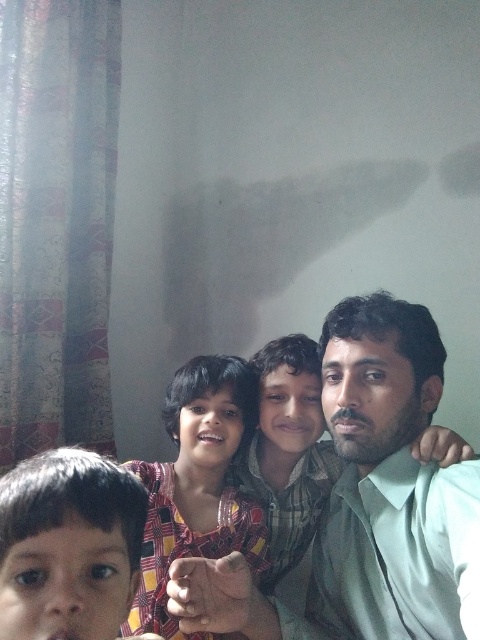
Does matte green shirt at center have a smaller size compared to plaid fabric shirt at center?

Actually, matte green shirt at center might be larger than plaid fabric shirt at center.

Which is in front, point (406, 579) or point (180, 554)?

Point (406, 579) is in front.

Where is `matte green shirt at center`? The height and width of the screenshot is (640, 480). matte green shirt at center is located at coordinates (391, 484).

This screenshot has width=480, height=640. What are the coordinates of `smooth brown hair at lower left` in the screenshot? It's located at (69, 545).

Can you confirm if smooth brown hair at lower left is smaller than plaid fabric shirt at center?

Correct, smooth brown hair at lower left occupies less space than plaid fabric shirt at center.

Locate an element on the screen. The width and height of the screenshot is (480, 640). smooth brown hair at lower left is located at coordinates (69, 545).

Can you confirm if plaid fabric shirt at center is smaller than light green shirt at center?

Yes, plaid fabric shirt at center is smaller than light green shirt at center.

Describe the element at coordinates (197, 484) in the screenshot. The height and width of the screenshot is (640, 480). I see `plaid fabric shirt at center` at that location.

I want to click on plaid fabric shirt at center, so click(197, 484).